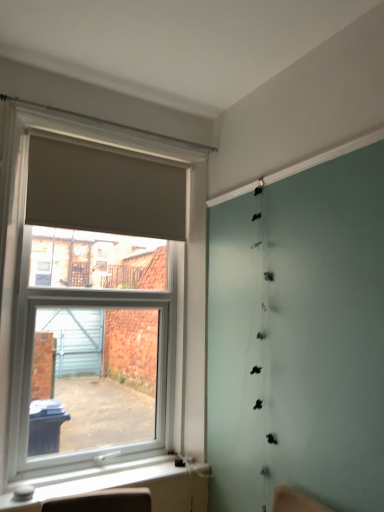
Question: In terms of height, does white plastic window sill at lower left look taller or shorter compared to matte gray roller blind at left?

Choices:
 (A) short
 (B) tall

Answer: (A)

Question: From a real-world perspective, is white plastic window sill at lower left above or below matte gray roller blind at left?

Choices:
 (A) below
 (B) above

Answer: (A)

Question: Considering the real-world distances, which object is farthest from the white plastic window sill at lower left?

Choices:
 (A) matte beige curtain at upper left
 (B) matte gray roller blind at left

Answer: (A)

Question: Which of these objects is positioned closest to the matte beige curtain at upper left?

Choices:
 (A) white plastic window sill at lower left
 (B) matte gray roller blind at left

Answer: (B)